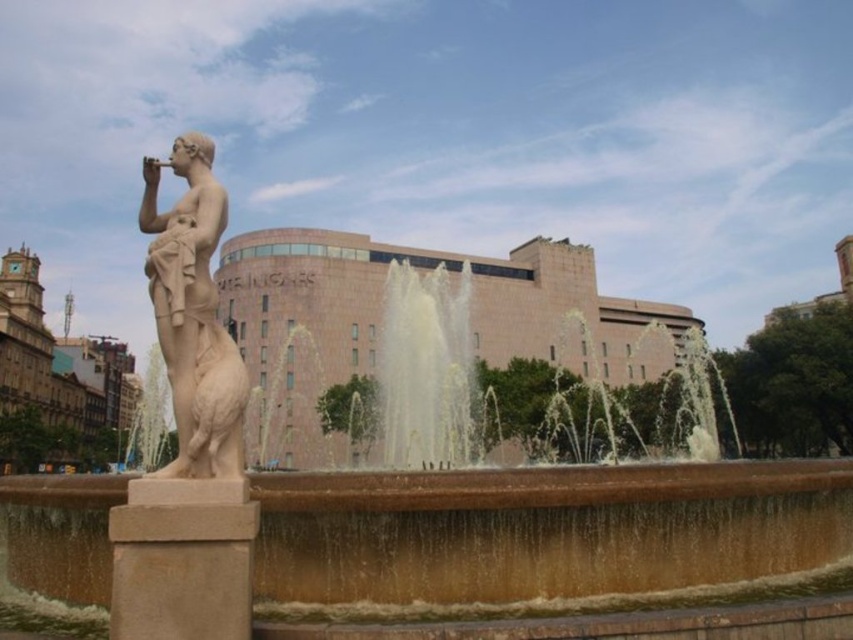
This screenshot has width=853, height=640. What do you see at coordinates (546, 536) in the screenshot?
I see `brown stone fountain at center` at bounding box center [546, 536].

Is brown stone fountain at center to the right of white marble statue at left from the viewer's perspective?

No, brown stone fountain at center is not to the right of white marble statue at left.

Based on the photo, measure the distance between brown stone fountain at center and camera.

The distance of brown stone fountain at center from camera is 15.34 meters.

Find the location of `brown stone fountain at center`. brown stone fountain at center is located at coordinates (546, 536).